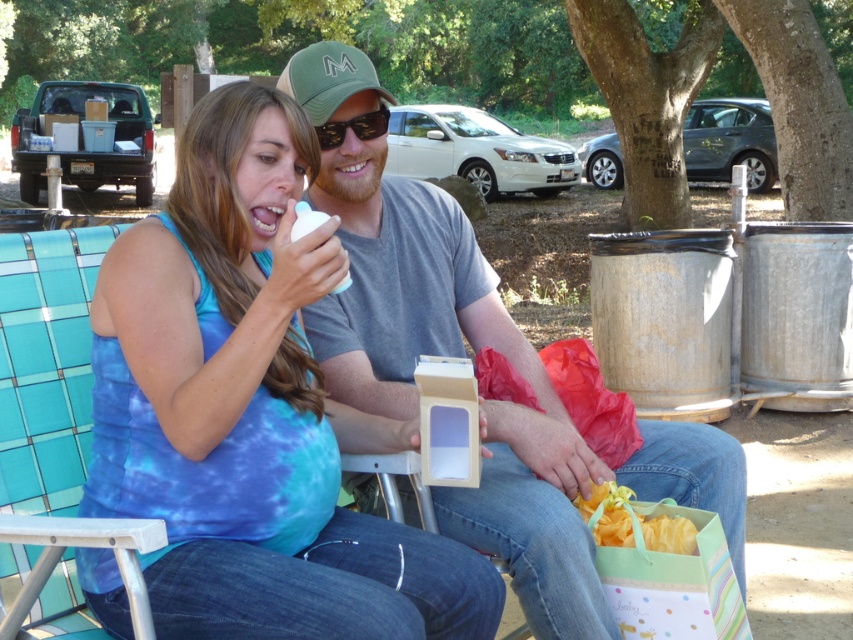
Does matte gray shirt at center appear under sunglasses at center?

Yes.

Can you confirm if matte gray shirt at center is bigger than sunglasses at center?

Indeed, matte gray shirt at center has a larger size compared to sunglasses at center.

Which is in front, point (577, 584) or point (339, 131)?

Point (577, 584) is in front.

I want to click on matte gray shirt at center, so click(486, 397).

Does blue tie-dye tank top at center appear over yellow silky ribbon at lower center?

Yes.

Who is positioned more to the left, blue tie-dye tank top at center or yellow silky ribbon at lower center?

Positioned to the left is blue tie-dye tank top at center.

Consider the image. Who is more forward, [144,515] or [660,518]?

Point [144,515]

Find the location of a particular element. blue tie-dye tank top at center is located at coordinates (252, 410).

Does blue tie-dye tank top at center appear on the left side of matte gray shirt at center?

Indeed, blue tie-dye tank top at center is positioned on the left side of matte gray shirt at center.

Can you confirm if blue tie-dye tank top at center is wider than matte gray shirt at center?

Incorrect, blue tie-dye tank top at center's width does not surpass matte gray shirt at center's.

Is point (445, 634) behind point (403, 308)?

No, (445, 634) is closer to viewer.

This screenshot has height=640, width=853. What are the coordinates of `blue tie-dye tank top at center` in the screenshot? It's located at (252, 410).